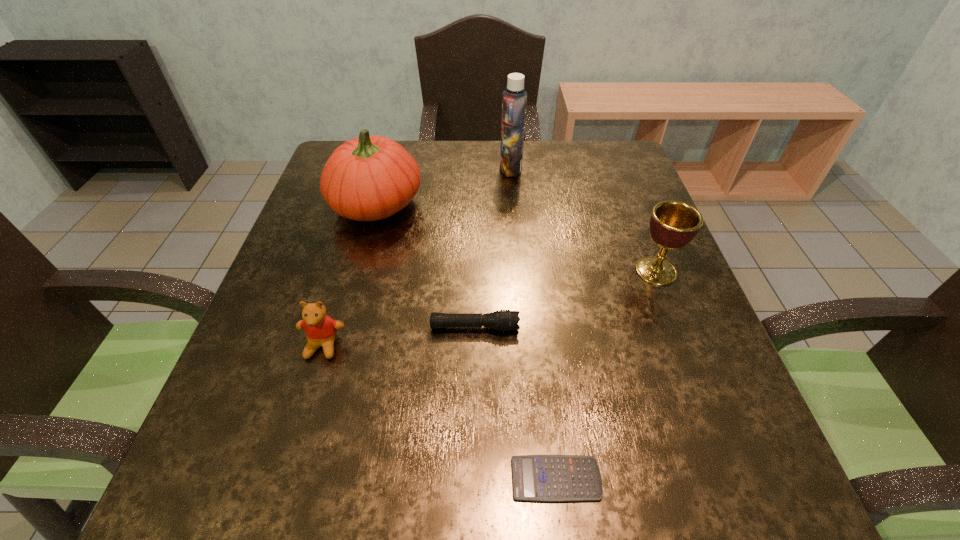
At what (x,y) coordinates should I click in order to perform the action: click on free space in the image that satisfies the following two spatial constraints: 1. on the front label of the nearest object; 2. on the right side of the tallest object. Please return your answer as a coordinate pair (x, y). The width and height of the screenshot is (960, 540). Looking at the image, I should click on (539, 478).

Locate an element on the screen. The height and width of the screenshot is (540, 960). free space that satisfies the following two spatial constraints: 1. at the lens end of the second shortest object; 2. on the front-facing side of the teddy bear is located at coordinates (474, 346).

Locate an element on the screen. This screenshot has height=540, width=960. free space that satisfies the following two spatial constraints: 1. on the front label of the tallest object; 2. on the front side of the pumpkin is located at coordinates (514, 205).

I want to click on free space that satisfies the following two spatial constraints: 1. on the front side of the fourth nearest object; 2. at the lens end of the fifth tallest object, so click(x=678, y=327).

Find the location of a particular element. The image size is (960, 540). blank area in the image that satisfies the following two spatial constraints: 1. at the lens end of the flashlight; 2. on the front-facing side of the teddy bear is located at coordinates (474, 346).

Locate an element on the screen. vacant position in the image that satisfies the following two spatial constraints: 1. at the lens end of the flashlight; 2. on the front-facing side of the fourth tallest object is located at coordinates (474, 346).

At what (x,y) coordinates should I click in order to perform the action: click on vacant space that satisfies the following two spatial constraints: 1. at the lens end of the flashlight; 2. on the front-facing side of the third shortest object. Please return your answer as a coordinate pair (x, y). Image resolution: width=960 pixels, height=540 pixels. Looking at the image, I should click on (474, 346).

The height and width of the screenshot is (540, 960). In order to click on vacant point that satisfies the following two spatial constraints: 1. on the front label of the fourth nearest object; 2. on the right side of the tallest object in this screenshot , I will do `click(519, 271)`.